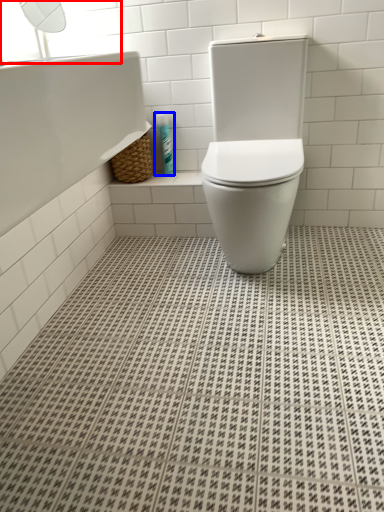
Question: Which of the following is the farthest to the observer, window screen (highlighted by a red box) or toiletry (highlighted by a blue box)?

Choices:
 (A) window screen
 (B) toiletry

Answer: (B)